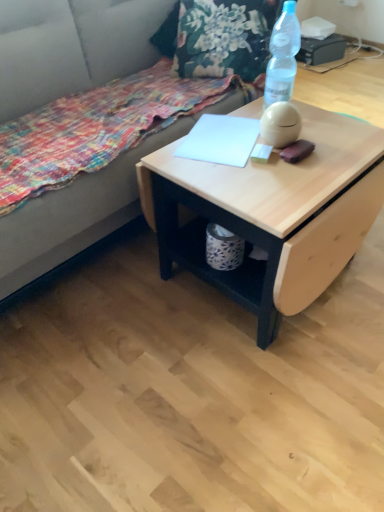
Find the location of a particular element. Image resolution: width=384 pixels, height=512 pixels. vacant region to the right of transparent plastic bottle at upper right is located at coordinates (324, 119).